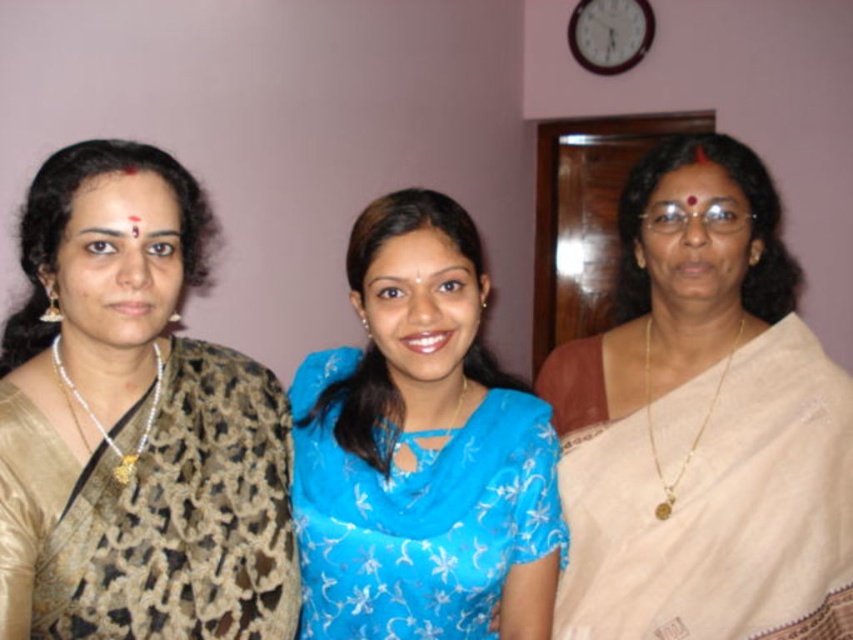
Who is shorter, brown textured saree at left or blue floral saree at center?

blue floral saree at center

Is brown textured saree at left above blue floral saree at center?

Indeed, brown textured saree at left is positioned over blue floral saree at center.

Which is in front, point (51, 416) or point (473, 353)?

Point (51, 416) is more forward.

Identify the location of brown textured saree at left. (132, 422).

Who is shorter, beige silk saree at right or brown textured saree at left?

brown textured saree at left

You are a GUI agent. You are given a task and a screenshot of the screen. Output one action in this format:
    pyautogui.click(x=<x>, y=<y>)
    Task: Click on the beige silk saree at right
    The image size is (853, 640).
    Given the screenshot: What is the action you would take?
    pyautogui.click(x=703, y=422)

Who is taller, beige silk saree at right or blue floral saree at center?

beige silk saree at right is taller.

From the picture: Is beige silk saree at right below blue floral saree at center?

No, beige silk saree at right is not below blue floral saree at center.

This screenshot has width=853, height=640. What are the coordinates of `beige silk saree at right` in the screenshot? It's located at [703, 422].